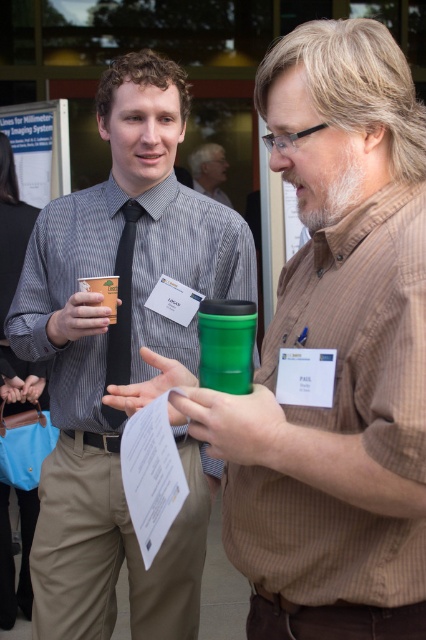
You are at a conference and need to choose a cup for your drink. You have two options in front of you, the green matte cup at left and the matte plastic cup at center. Which cup has a larger width?

The green matte cup at left has a larger width than the matte plastic cup at center.

You are a barista at a conference and need to pour a hot beverage into either the green plastic cup at center or the matte plastic cup at center. Which cup should you choose to ensure the beverage stays hot longer?

The green plastic cup at center has a greater height compared to the matte plastic cup at center, so it can hold more liquid and potentially retain heat better.

You are an event organizer at a conference and need to identify where a specific point on the attendee named Logan is located. The point is at coordinates point (120, 358). Based on the scene description, where exactly on Logan is this point located?

The point (120, 358) is located on the matte black tie at left.